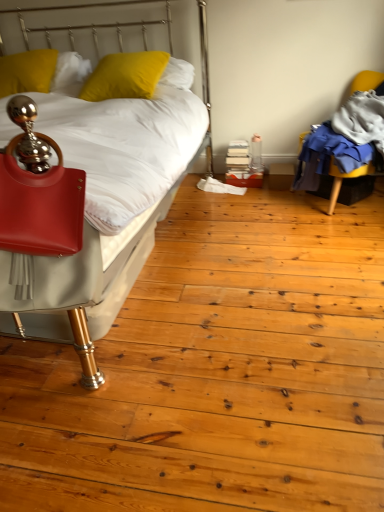
Question: Is matte red handbag at left beside matte white bed at left?

Choices:
 (A) no
 (B) yes

Answer: (A)

Question: Is matte red handbag at left to the right of matte white bed at left from the viewer's perspective?

Choices:
 (A) no
 (B) yes

Answer: (B)

Question: Is matte red handbag at left thinner than matte white bed at left?

Choices:
 (A) no
 (B) yes

Answer: (B)

Question: From a real-world perspective, is matte red handbag at left located beneath matte white bed at left?

Choices:
 (A) yes
 (B) no

Answer: (B)

Question: Is matte red handbag at left taller than matte white bed at left?

Choices:
 (A) yes
 (B) no

Answer: (B)

Question: From the image's perspective, is yellow matte pillow at upper left, which is the 2th pillow in left-to-right order, above or below matte white bed at left?

Choices:
 (A) above
 (B) below

Answer: (A)

Question: Considering the positions of yellow matte pillow at upper left, positioned as the 1th pillow in right-to-left order, and matte white bed at left in the image, is yellow matte pillow at upper left, positioned as the 1th pillow in right-to-left order, wider or thinner than matte white bed at left?

Choices:
 (A) wide
 (B) thin

Answer: (B)

Question: Considering the positions of point (96, 71) and point (56, 332), is point (96, 71) closer or farther from the camera than point (56, 332)?

Choices:
 (A) closer
 (B) farther

Answer: (B)

Question: Is yellow matte pillow at upper left, positioned as the 1th pillow in right-to-left order, situated inside matte white bed at left or outside?

Choices:
 (A) outside
 (B) inside

Answer: (B)

Question: Is matte white bed at left inside the boundaries of yellow matte pillow at upper left, positioned as the 1th pillow in right-to-left order, or outside?

Choices:
 (A) outside
 (B) inside

Answer: (A)

Question: Is point (114, 306) closer or farther from the camera than point (92, 81)?

Choices:
 (A) closer
 (B) farther

Answer: (A)

Question: Considering the positions of matte white bed at left and yellow matte pillow at upper left, positioned as the 1th pillow in right-to-left order, in the image, is matte white bed at left taller or shorter than yellow matte pillow at upper left, positioned as the 1th pillow in right-to-left order,?

Choices:
 (A) short
 (B) tall

Answer: (B)

Question: Looking at their shapes, would you say matte white bed at left is wider or thinner than yellow matte pillow at upper left, which is the 2th pillow in left-to-right order?

Choices:
 (A) thin
 (B) wide

Answer: (B)

Question: Visually, is yellow fabric chair at right positioned to the left or to the right of yellow matte pillow at upper left, arranged as the second pillow when viewed from the right?

Choices:
 (A) right
 (B) left

Answer: (A)

Question: Is yellow fabric chair at right situated inside yellow matte pillow at upper left, which is the first pillow in left-to-right order, or outside?

Choices:
 (A) inside
 (B) outside

Answer: (B)